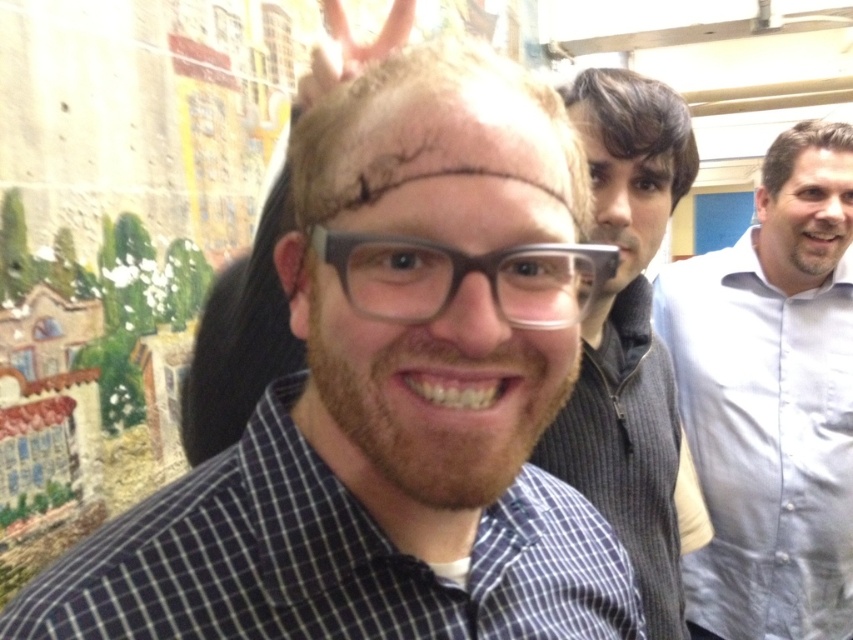
You are a tailor measuring the gray ribbed sweater at center and the dry skin at center. Which item requires more horizontal space for storage?

The gray ribbed sweater at center might be wider than dry skin at center, so it requires more horizontal space for storage.

You are a photographer trying to capture a clear shot of the transparent plastic glasses at center. However, the light blue shirt at right is blocking your view. Can you move around to the left side to get a better angle? Explain why or why not based on their positions.

The light blue shirt at right is further to the viewer than transparent plastic glasses at center, so moving to the left might not help because the light blue shirt at right is closer and still blocking the view.

You are a tailor who needs to determine if the blue checkered shirt at center can fit over the dry skin at center. Based on their sizes, can the shirt accommodate the skin?

The blue checkered shirt at center is wider than the dry skin at center, so it should fit comfortably over the dry skin at center.